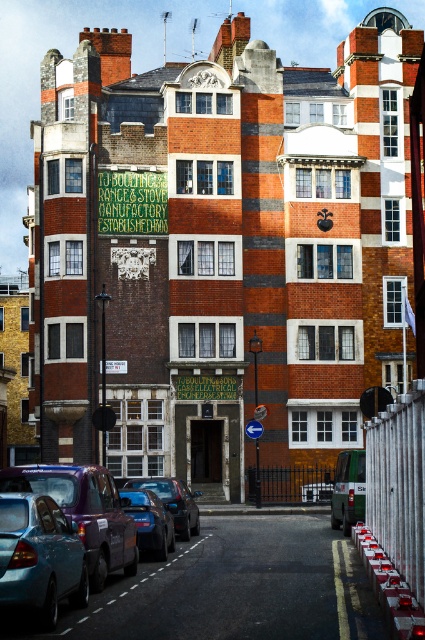
Question: Can you confirm if metallic blue car at lower left is bigger than matte blue car at lower left?

Choices:
 (A) yes
 (B) no

Answer: (A)

Question: Which point is closer to the camera?

Choices:
 (A) (340, 522)
 (B) (181, 490)

Answer: (B)

Question: Does metallic blue car at lower left lie behind matte blue car at lower left?

Choices:
 (A) yes
 (B) no

Answer: (A)

Question: Which point is closer to the camera?

Choices:
 (A) shiny black car at lower left
 (B) metallic blue car at lower left
 (C) metallic blue car at center

Answer: (B)

Question: Can you confirm if matte blue car at lower left is thinner than shiny black car at lower left?

Choices:
 (A) no
 (B) yes

Answer: (B)

Question: Which point is farther from the camera taking this photo?

Choices:
 (A) (333, 493)
 (B) (19, 497)
 (C) (36, 566)
 (D) (197, 506)

Answer: (D)